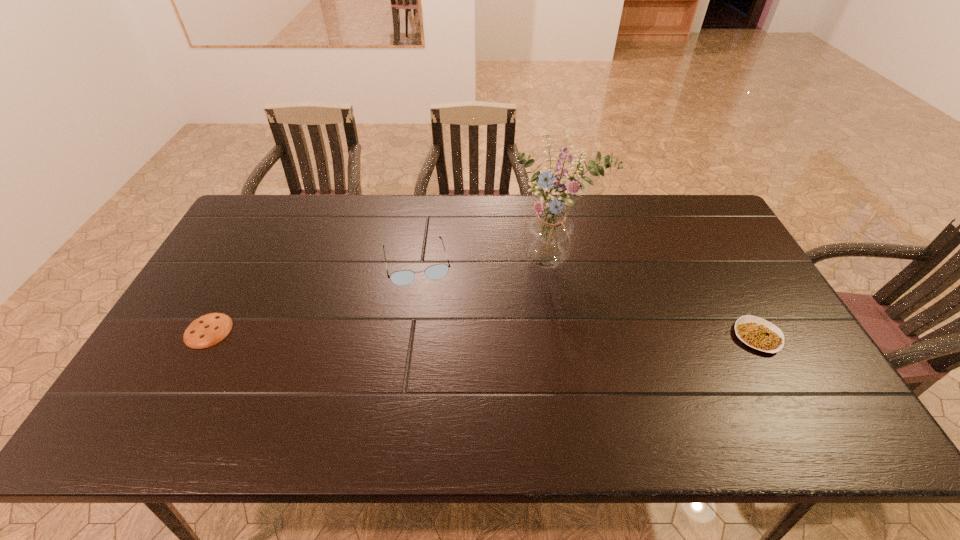
Identify the location of vacant space on the desktop that is between the shortest object and the rightmost object and is positioned on the lenses of the third shortest object. (432, 333).

In order to click on vacant space on the desktop that is between the cookie and the third tallest object and is positioned on the front-facing side of the bouquet in this screenshot , I will do `click(557, 334)`.